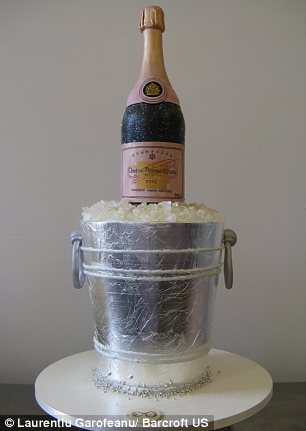
This screenshot has height=431, width=306. In order to click on table in this screenshot , I will do `click(242, 396)`.